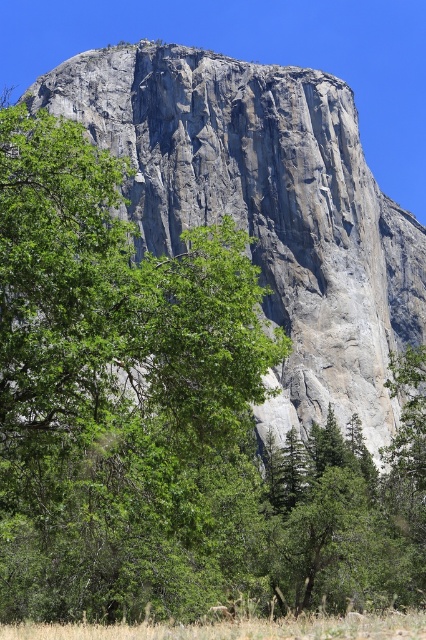
Question: Which object appears closest to the camera in this image?

Choices:
 (A) dry grass at lower center
 (B) brown fur at lower center

Answer: (A)

Question: Observing the image, what is the correct spatial positioning of gray rock mountain at center in reference to brown fur at lower center?

Choices:
 (A) right
 (B) left

Answer: (A)

Question: Is gray rock mountain at center thinner than dry grass at lower center?

Choices:
 (A) no
 (B) yes

Answer: (A)

Question: Is gray rock mountain at center in front of dry grass at lower center?

Choices:
 (A) no
 (B) yes

Answer: (A)

Question: Which of the following is the farthest from the observer?

Choices:
 (A) brown fur at lower center
 (B) gray rock mountain at center
 (C) dry grass at lower center

Answer: (B)

Question: Among these objects, which one is nearest to the camera?

Choices:
 (A) gray rock mountain at center
 (B) brown fur at lower center

Answer: (B)